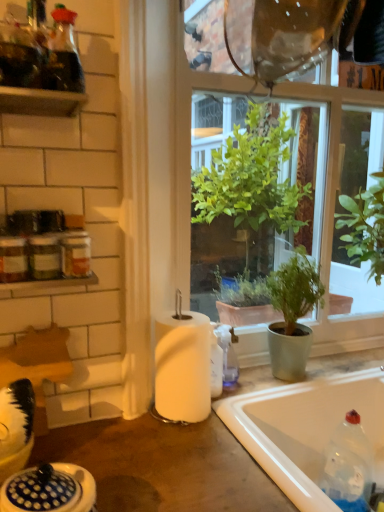
Question: From their relative heights in the image, would you say wooden shelf at upper left is taller or shorter than white glossy sink at lower left?

Choices:
 (A) tall
 (B) short

Answer: (B)

Question: In terms of width, does wooden shelf at upper left look wider or thinner when compared to white glossy sink at lower left?

Choices:
 (A) wide
 (B) thin

Answer: (A)

Question: Which object is the closest to the green matte plant at center?

Choices:
 (A) transparent glass window at center
 (B) clear plastic bottle at lower right
 (C) white glossy shelf at upper left
 (D) white glossy sink at lower left
 (E) white matte paper towel at center

Answer: (B)

Question: Estimate the real-world distances between objects in this image. Which object is closer to the white glossy bathtub at lower right?

Choices:
 (A) matte white countertop at center
 (B) white glossy shelf at upper left
 (C) green matte plant at center
 (D) transparent glass window at center
 (E) wooden shelf at upper left

Answer: (A)